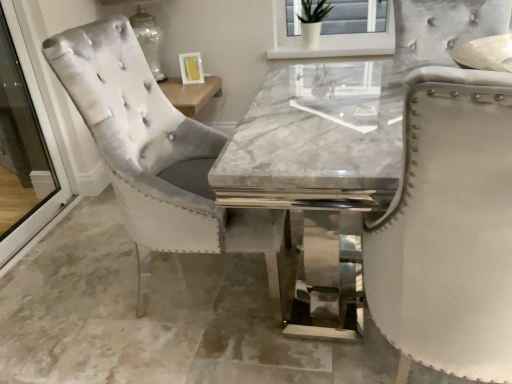
Question: In terms of size, does velvet chair at left appear bigger or smaller than clear glass screen door at left?

Choices:
 (A) big
 (B) small

Answer: (A)

Question: Is velvet chair at left wider or thinner than clear glass screen door at left?

Choices:
 (A) wide
 (B) thin

Answer: (A)

Question: In the image, is velvet chair at left positioned in front of or behind clear glass screen door at left?

Choices:
 (A) behind
 (B) front

Answer: (B)

Question: Considering the positions of clear glass screen door at left and velvet chair at left in the image, is clear glass screen door at left bigger or smaller than velvet chair at left?

Choices:
 (A) big
 (B) small

Answer: (B)

Question: Considering the positions of clear glass screen door at left and velvet chair at left in the image, is clear glass screen door at left taller or shorter than velvet chair at left?

Choices:
 (A) short
 (B) tall

Answer: (B)

Question: Considering the positions of clear glass screen door at left and velvet chair at left in the image, is clear glass screen door at left wider or thinner than velvet chair at left?

Choices:
 (A) thin
 (B) wide

Answer: (A)

Question: Visually, is clear glass screen door at left positioned to the left or to the right of velvet chair at left?

Choices:
 (A) right
 (B) left

Answer: (B)